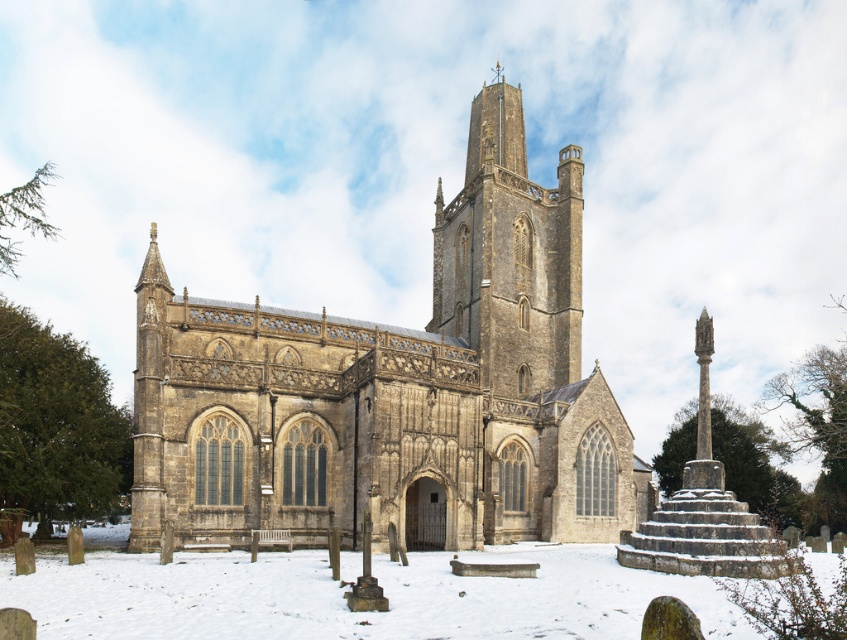
You are an architect assessing the structural integrity of the stone church at center and the brown stone tower at center. Which structure requires more material to construct due to its size?

The stone church at center requires more material to construct because it has a larger size compared to the brown stone tower at center.

You are standing in a snowy churchyard and want to take a photo of the stone church at center. If your camera can focus on objects up to 50 meters away, will you need to move closer to get a clear shot?

The stone church at center is 55.65 meters away from the viewer. Since the camera can only focus up to 50 meters, you need to move closer to ensure the stone church at center is within the camera range.